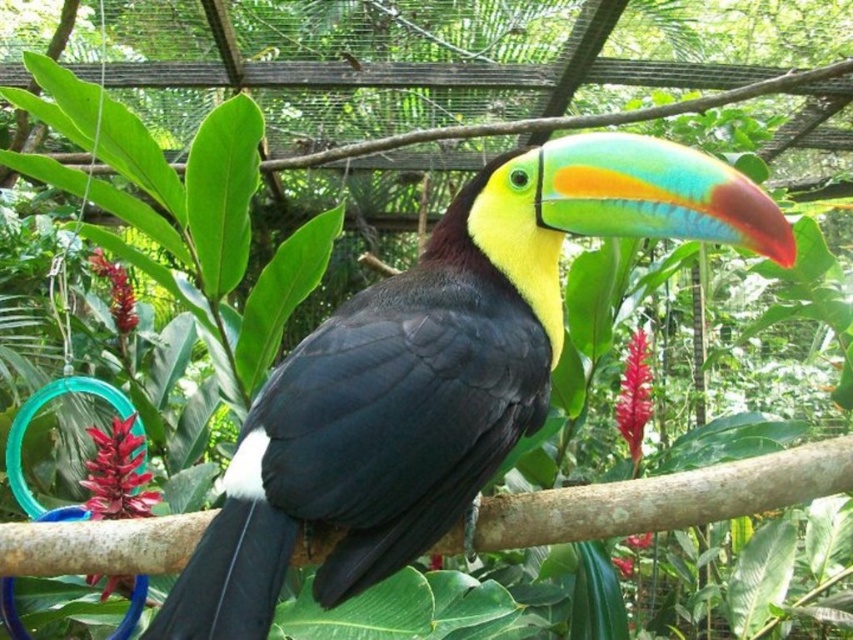
Can you confirm if shiny black toucan at center is positioned below brown wood at center?

Actually, shiny black toucan at center is above brown wood at center.

You are a GUI agent. You are given a task and a screenshot of the screen. Output one action in this format:
    pyautogui.click(x=<x>, y=<y>)
    Task: Click on the shiny black toucan at center
    Image resolution: width=853 pixels, height=640 pixels.
    Given the screenshot: What is the action you would take?
    pyautogui.click(x=437, y=372)

Where is `shiny black toucan at center`? shiny black toucan at center is located at coordinates (437, 372).

Identify the location of shiny black toucan at center. (437, 372).